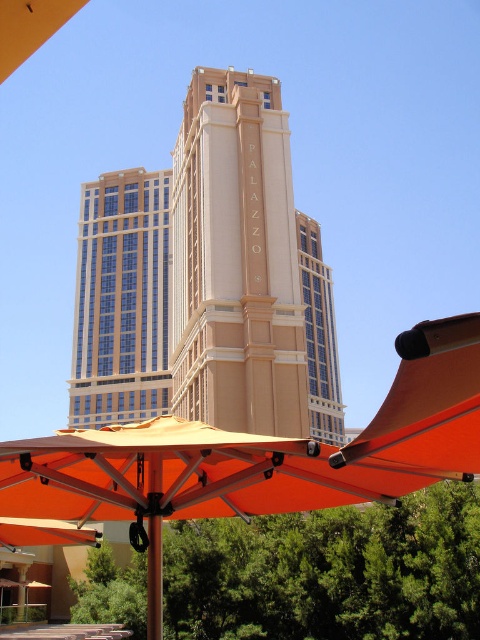
Question: Is orange fabric umbrella at lower center below beige stone tower at center?

Choices:
 (A) yes
 (B) no

Answer: (A)

Question: Which point is farther to the camera?

Choices:
 (A) (440, 378)
 (B) (200, 129)

Answer: (B)

Question: Can you confirm if orange fabric umbrella at lower center is positioned to the right of beige stone tower at center?

Choices:
 (A) no
 (B) yes

Answer: (B)

Question: Is orange fabric umbrella at lower center bigger than beige stone tower at center?

Choices:
 (A) yes
 (B) no

Answer: (B)

Question: Among these points, which one is farthest from the camera?

Choices:
 (A) (264, 349)
 (B) (465, 365)

Answer: (A)